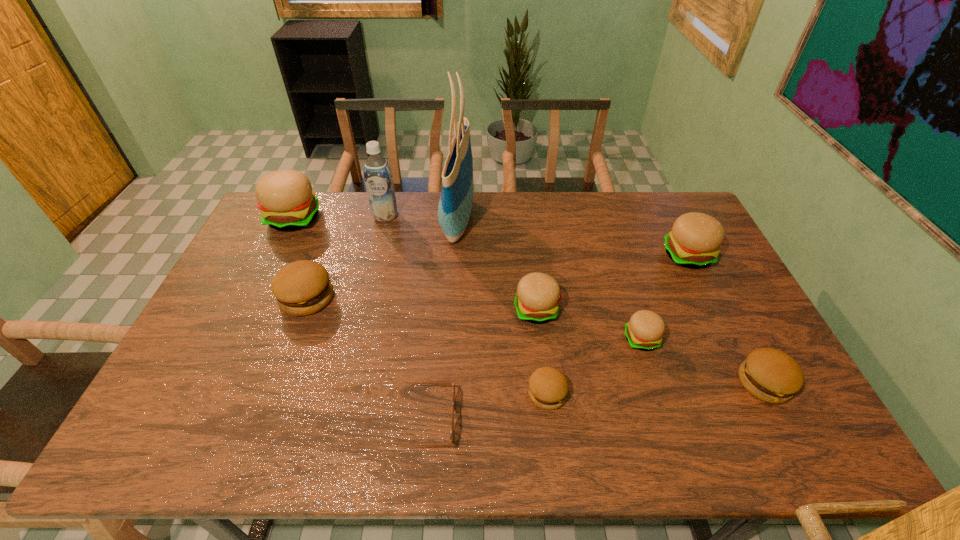
What are the coordinates of `unoccupied position between the smallest brown hamburger and the eighth shortest object` in the screenshot? It's located at (420, 306).

Where is `unoccupied area between the soya milk and the blue tote bag`? unoccupied area between the soya milk and the blue tote bag is located at coordinates (421, 218).

In order to click on free space between the third object from left to right and the farthest brown hamburger in this screenshot , I will do `click(346, 256)`.

Find the location of a particular element. This screenshot has width=960, height=540. empty space that is in between the biggest brown hamburger and the second smallest beige hamburger is located at coordinates (421, 303).

The width and height of the screenshot is (960, 540). I want to click on empty space between the smallest brown hamburger and the sixth nearest hamburger, so click(617, 325).

The height and width of the screenshot is (540, 960). Identify the location of vacant area that lies between the shortest hamburger and the second beige hamburger from right to left. (594, 366).

Where is `vacant space that is in between the second smallest brown hamburger and the shortest object`? vacant space that is in between the second smallest brown hamburger and the shortest object is located at coordinates (592, 402).

This screenshot has width=960, height=540. What are the coordinates of `free spot between the farthest brown hamburger and the second biggest beige hamburger` in the screenshot? It's located at (497, 276).

Find the location of `object that can be found as the fourth closest to the rightmost brown hamburger`. object that can be found as the fourth closest to the rightmost brown hamburger is located at coordinates (538, 294).

The width and height of the screenshot is (960, 540). I want to click on object that is the sixth nearest to the second biggest brown hamburger, so click(456, 200).